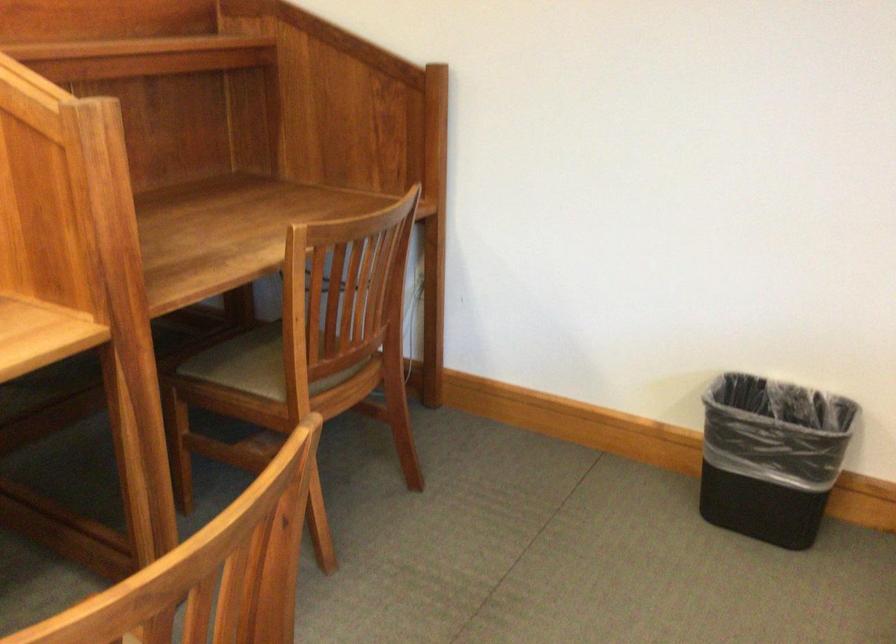
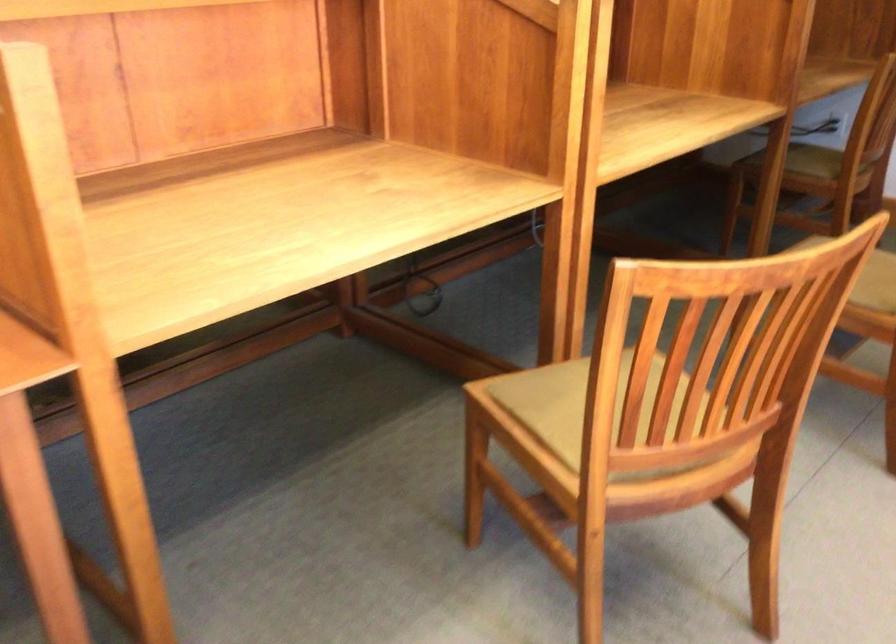
The images are taken continuously from a first-person perspective. In which direction are you moving?

The movement direction of the cameraman is left, backward.